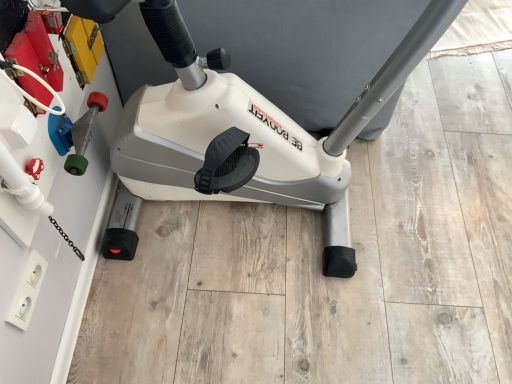
I want to click on free location in front of white matte stationary bicycle at center, so click(258, 326).